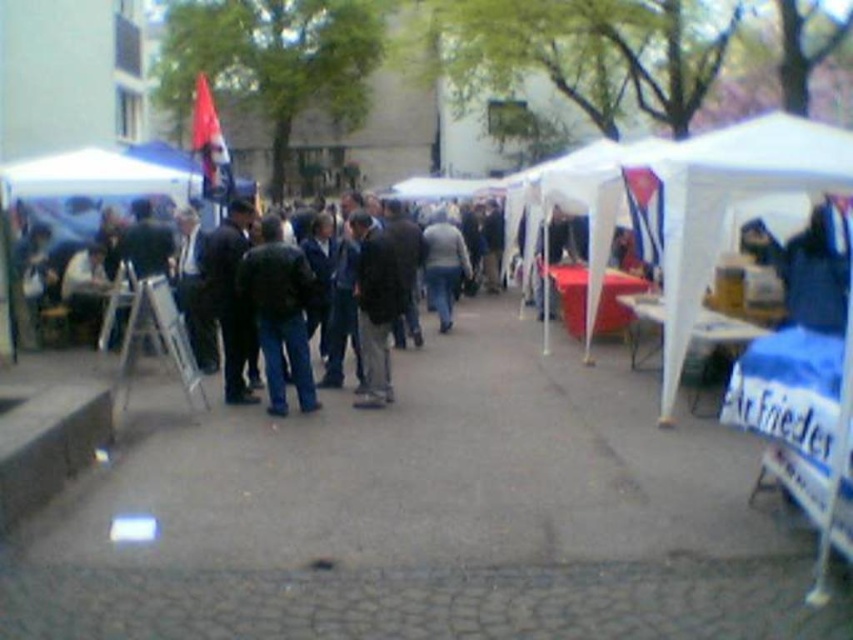
Who is positioned more to the right, white fabric canopy at right or dark blue leather jacket at center?

From the viewer's perspective, white fabric canopy at right appears more on the right side.

Which is behind, point (814, 156) or point (302, 403)?

The point (302, 403) is more distant.

Find the location of a particular element. The image size is (853, 640). white fabric canopy at right is located at coordinates (730, 205).

Who is more forward, (231, 321) or (430, 273)?

Point (231, 321)

Who is more distant from viewer, (149, 212) or (431, 300)?

The point (431, 300) is behind.

At what (x,y) coordinates should I click in order to perform the action: click on dark blue jacket at center. Please return your answer as a coordinate pair (x, y). Looking at the image, I should click on tap(259, 304).

Where is `dark blue jacket at center`? The image size is (853, 640). dark blue jacket at center is located at coordinates (259, 304).

Is point (801, 186) farther from camera compared to point (439, 234)?

No, it is not.

What do you see at coordinates (730, 205) in the screenshot? The height and width of the screenshot is (640, 853). I see `white fabric canopy at right` at bounding box center [730, 205].

Does point (664, 381) come farther from viewer compared to point (438, 241)?

No, (664, 381) is in front of (438, 241).

Where is `white fabric canopy at right`? white fabric canopy at right is located at coordinates (730, 205).